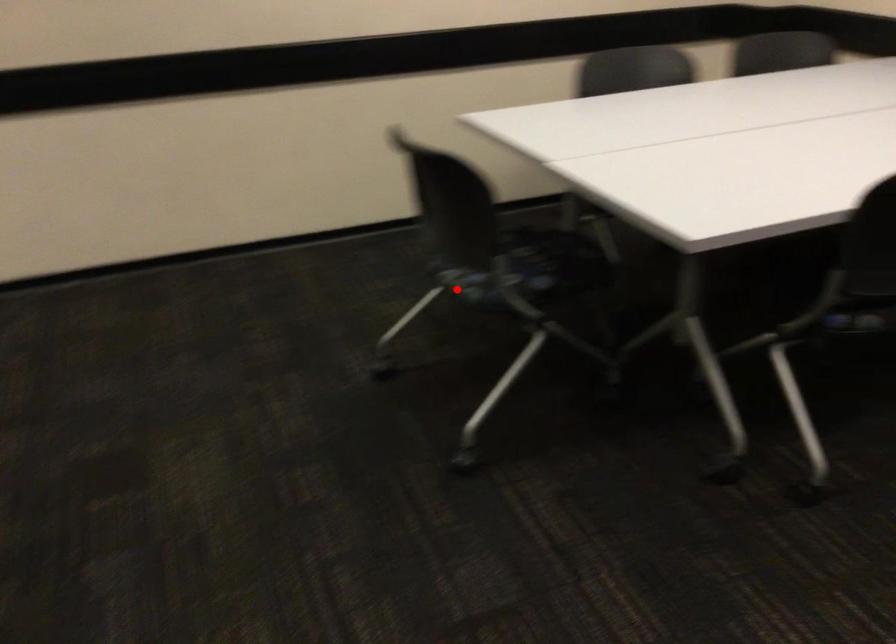
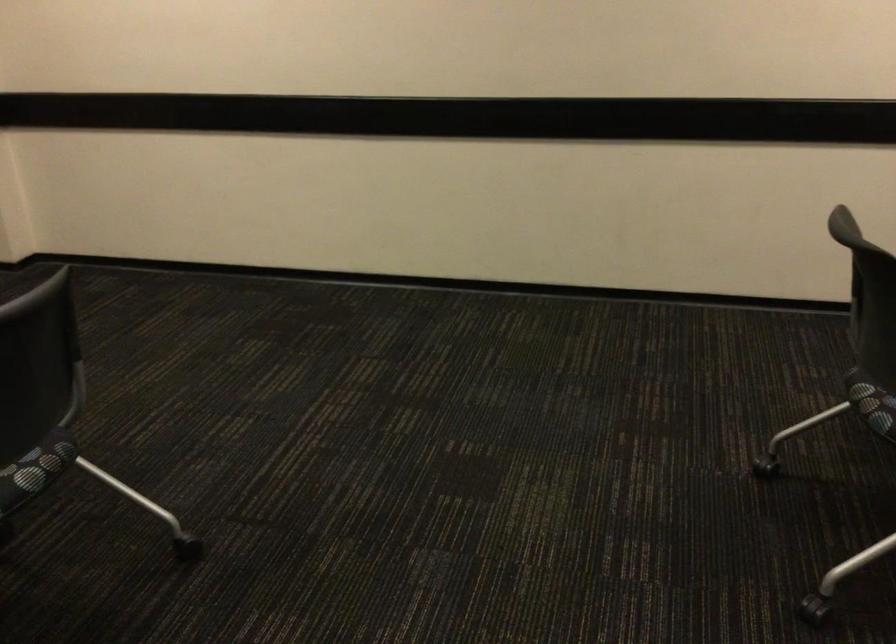
Question: I am providing you with two images of the same scene from different viewpoints. A red point is marked on the first image. At the location where the point appears in image 1, is it still visible in image 2?

Choices:
 (A) Yes
 (B) No

Answer: (A)